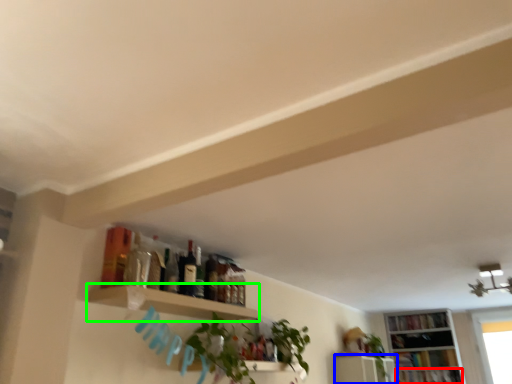
Question: Which object is the closest to the book (highlighted by a red box)? Choose among these: shelf (highlighted by a blue box) or shelf (highlighted by a green box).

Choices:
 (A) shelf
 (B) shelf

Answer: (A)